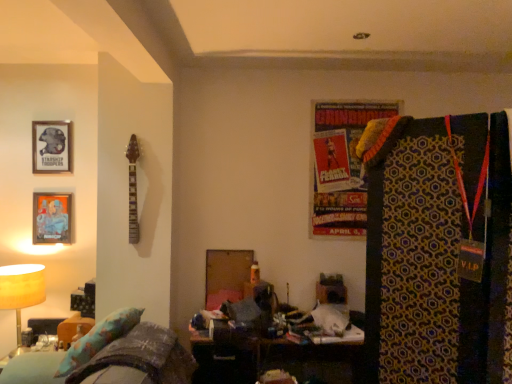
In order to face metallic silver picture frame at left, which is the second picture frame from top to bottom, should I rotate leftwards or rightwards?

Turn left approximately 25.006 degrees to face it.

At what (x,y) coordinates should I click in order to perform the action: click on metallic silver picture frame at upper left, positioned as the 1th picture frame in top-to-bottom order. Please return your answer as a coordinate pair (x, y). The width and height of the screenshot is (512, 384). Looking at the image, I should click on (51, 146).

Considering the positions of point (3, 380) and point (69, 213), is point (3, 380) closer or farther from the camera than point (69, 213)?

Point (3, 380).

Could you tell me if fluffy fabric couch at lower left is facing metallic silver picture frame at left, which is the second picture frame from top to bottom?

No, fluffy fabric couch at lower left is not aimed at metallic silver picture frame at left, which is the second picture frame from top to bottom.

How distant is fluffy fabric couch at lower left from metallic silver picture frame at left, which is the second picture frame from top to bottom?

A distance of 3.54 feet exists between fluffy fabric couch at lower left and metallic silver picture frame at left, which is the second picture frame from top to bottom.

Is metallic silver picture frame at left, which is the second picture frame from top to bottom, inside fluffy fabric couch at lower left?

That's incorrect, metallic silver picture frame at left, which is the second picture frame from top to bottom, is not inside fluffy fabric couch at lower left.

Locate an element on the screen. Image resolution: width=512 pixels, height=384 pixels. picture frame on the right side of metallic silver picture frame at left, which is the second picture frame from top to bottom is located at coordinates (51, 146).

Which is in front, metallic silver picture frame at left, which is the second picture frame from top to bottom, or metallic silver picture frame at upper left, positioned as the 1th picture frame in top-to-bottom order?

metallic silver picture frame at left, which is the second picture frame from top to bottom.

Do you think metallic silver picture frame at left, the 1th picture frame ordered from the bottom, is within metallic silver picture frame at upper left, which appears as the 2th picture frame when ordered from the bottom, or outside of it?

metallic silver picture frame at left, the 1th picture frame ordered from the bottom, lies outside metallic silver picture frame at upper left, which appears as the 2th picture frame when ordered from the bottom.

Can you confirm if fluffy fabric couch at lower left is taller than matte yellow lampshade at left?

No, fluffy fabric couch at lower left is not taller than matte yellow lampshade at left.

Is fluffy fabric couch at lower left to the left of matte yellow lampshade at left from the viewer's perspective?

No, fluffy fabric couch at lower left is not to the left of matte yellow lampshade at left.

From the image's perspective, is fluffy fabric couch at lower left positioned above or below matte yellow lampshade at left?

Based on their image positions, fluffy fabric couch at lower left is located beneath matte yellow lampshade at left.

Considering the sizes of objects fluffy fabric couch at lower left and matte yellow lampshade at left in the image provided, who is bigger, fluffy fabric couch at lower left or matte yellow lampshade at left?

fluffy fabric couch at lower left.

From the picture: Which of these two, matte yellow lampshade at left or fluffy fabric couch at lower left, is smaller?

Smaller between the two is matte yellow lampshade at left.

Based on the photo, from a real-world perspective, is matte yellow lampshade at left positioned under fluffy fabric couch at lower left based on gravity?

No, from a real-world perspective, matte yellow lampshade at left is not under fluffy fabric couch at lower left.

Is matte yellow lampshade at left taller or shorter than fluffy fabric couch at lower left?

Considering their sizes, matte yellow lampshade at left has more height than fluffy fabric couch at lower left.

How distant is matte yellow lampshade at left from fluffy fabric couch at lower left?

They are 30.08 inches apart.

Is metallic silver picture frame at upper left, which appears as the 2th picture frame when ordered from the bottom, shorter than fluffy fabric couch at lower left?

In fact, metallic silver picture frame at upper left, which appears as the 2th picture frame when ordered from the bottom, may be taller than fluffy fabric couch at lower left.

Looking at this image, is metallic silver picture frame at upper left, positioned as the 1th picture frame in top-to-bottom order, bigger or smaller than fluffy fabric couch at lower left?

metallic silver picture frame at upper left, positioned as the 1th picture frame in top-to-bottom order, is smaller than fluffy fabric couch at lower left.

Does point (56, 168) appear closer or farther from the camera than point (175, 367)?

Point (56, 168) is positioned farther from the camera compared to point (175, 367).

Is metallic silver picture frame at left, which is the second picture frame from top to bottom, positioned in front of fluffy fabric couch at lower left?

No, the depth of metallic silver picture frame at left, which is the second picture frame from top to bottom, is greater than that of fluffy fabric couch at lower left.

From the image's perspective, is metallic silver picture frame at left, the 1th picture frame ordered from the bottom, located beneath fluffy fabric couch at lower left?

No, from the image's perspective, metallic silver picture frame at left, the 1th picture frame ordered from the bottom, is not below fluffy fabric couch at lower left.

Can you confirm if metallic silver picture frame at left, which is the second picture frame from top to bottom, is thinner than fluffy fabric couch at lower left?

Indeed, metallic silver picture frame at left, which is the second picture frame from top to bottom, has a lesser width compared to fluffy fabric couch at lower left.

Identify the location of the 1st picture frame located above the fluffy fabric couch at lower left (from a real-world perspective). Image resolution: width=512 pixels, height=384 pixels. (52, 218).

How many degrees apart are the facing directions of fluffy fabric couch at lower left and metallic silver picture frame at upper left, positioned as the 1th picture frame in top-to-bottom order?

There is a 92.3-degree angle between the facing directions of fluffy fabric couch at lower left and metallic silver picture frame at upper left, positioned as the 1th picture frame in top-to-bottom order.

Are fluffy fabric couch at lower left and metallic silver picture frame at upper left, which appears as the 2th picture frame when ordered from the bottom, far apart?

Indeed, fluffy fabric couch at lower left is not near metallic silver picture frame at upper left, which appears as the 2th picture frame when ordered from the bottom.

Where is `picture frame that is the 2nd object above the fluffy fabric couch at lower left (from a real-world perspective)`? The image size is (512, 384). picture frame that is the 2nd object above the fluffy fabric couch at lower left (from a real-world perspective) is located at coordinates (51, 146).

Identify the location of picture frame that is the 1st object above the fluffy fabric couch at lower left (from a real-world perspective). This screenshot has height=384, width=512. (52, 218).

Identify the location of picture frame on the right side of metallic silver picture frame at left, the 1th picture frame ordered from the bottom. The width and height of the screenshot is (512, 384). (51, 146).

Based on their spatial positions, is metallic silver picture frame at left, which is the second picture frame from top to bottom, or metallic silver picture frame at upper left, which appears as the 2th picture frame when ordered from the bottom, further from fluffy fabric couch at lower left?

The object further to fluffy fabric couch at lower left is metallic silver picture frame at upper left, which appears as the 2th picture frame when ordered from the bottom.

Considering their positions, is metallic silver picture frame at upper left, which appears as the 2th picture frame when ordered from the bottom, positioned closer to metallic silver picture frame at left, which is the second picture frame from top to bottom, than matte yellow lampshade at left?

metallic silver picture frame at upper left, which appears as the 2th picture frame when ordered from the bottom, lies closer to metallic silver picture frame at left, which is the second picture frame from top to bottom, than the other object.

Consider the image. Considering their positions, is matte yellow lampshade at left positioned closer to metallic silver picture frame at left, the 1th picture frame ordered from the bottom, than metallic silver picture frame at upper left, positioned as the 1th picture frame in top-to-bottom order?

The object closer to metallic silver picture frame at left, the 1th picture frame ordered from the bottom, is metallic silver picture frame at upper left, positioned as the 1th picture frame in top-to-bottom order.

Which object lies nearer to the anchor point fluffy fabric couch at lower left, metallic silver picture frame at left, which is the second picture frame from top to bottom, or matte yellow lampshade at left?

matte yellow lampshade at left is closer to fluffy fabric couch at lower left.

From the image, which object appears to be farther from fluffy fabric couch at lower left, matte yellow lampshade at left or metallic silver picture frame at upper left, positioned as the 1th picture frame in top-to-bottom order?

metallic silver picture frame at upper left, positioned as the 1th picture frame in top-to-bottom order, is further to fluffy fabric couch at lower left.

When comparing their distances from matte yellow lampshade at left, does fluffy fabric couch at lower left or metallic silver picture frame at upper left, positioned as the 1th picture frame in top-to-bottom order, seem closer?

fluffy fabric couch at lower left is positioned closer to the anchor matte yellow lampshade at left.

Estimate the real-world distances between objects in this image. Which object is closer to metallic silver picture frame at upper left, which appears as the 2th picture frame when ordered from the bottom, matte yellow lampshade at left or fluffy fabric couch at lower left?

matte yellow lampshade at left lies closer to metallic silver picture frame at upper left, which appears as the 2th picture frame when ordered from the bottom, than the other object.

Estimate the real-world distances between objects in this image. Which object is closer to matte yellow lampshade at left, metallic silver picture frame at left, which is the second picture frame from top to bottom, or metallic silver picture frame at upper left, positioned as the 1th picture frame in top-to-bottom order?

metallic silver picture frame at left, which is the second picture frame from top to bottom, lies closer to matte yellow lampshade at left than the other object.

You are a GUI agent. You are given a task and a screenshot of the screen. Output one action in this format:
    pyautogui.click(x=<x>, y=<y>)
    Task: Click on the picture frame that lies between metallic silver picture frame at upper left, positioned as the 1th picture frame in top-to-bottom order, and matte yellow lampshade at left from top to bottom
    This screenshot has width=512, height=384.
    Given the screenshot: What is the action you would take?
    pyautogui.click(x=52, y=218)

You are a GUI agent. You are given a task and a screenshot of the screen. Output one action in this format:
    pyautogui.click(x=<x>, y=<y>)
    Task: Click on the picture frame located between fluffy fabric couch at lower left and metallic silver picture frame at upper left, which appears as the 2th picture frame when ordered from the bottom, in the depth direction
    This screenshot has width=512, height=384.
    Given the screenshot: What is the action you would take?
    pyautogui.click(x=52, y=218)

Image resolution: width=512 pixels, height=384 pixels. In order to click on table lamp that lies between metallic silver picture frame at upper left, positioned as the 1th picture frame in top-to-bottom order, and fluffy fabric couch at lower left from top to bottom in this screenshot , I will do `click(21, 293)`.

The width and height of the screenshot is (512, 384). I want to click on table lamp between fluffy fabric couch at lower left and metallic silver picture frame at left, which is the second picture frame from top to bottom, from front to back, so click(x=21, y=293).